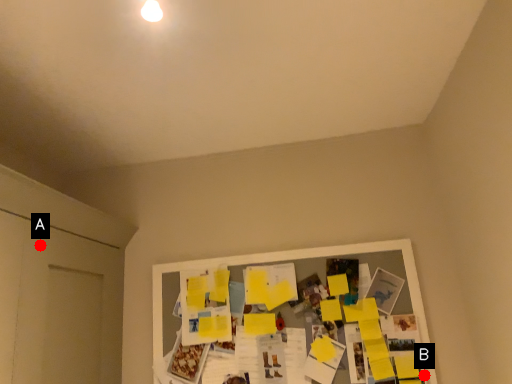
Question: Two points are circled on the image, labeled by A and B beside each circle. Which point is closer to the camera?

Choices:
 (A) A is closer
 (B) B is closer

Answer: (A)